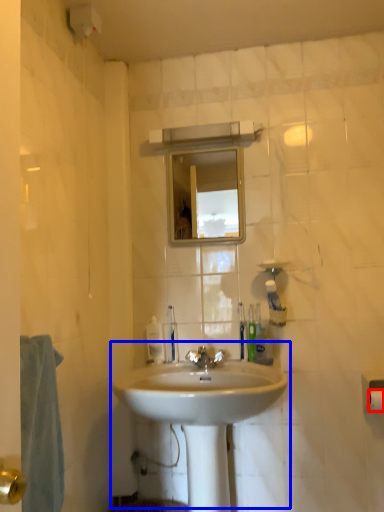
Question: Among these objects, which one is nearest to the camera, toilet paper (highlighted by a red box) or sink (highlighted by a blue box)?

Choices:
 (A) toilet paper
 (B) sink

Answer: (B)